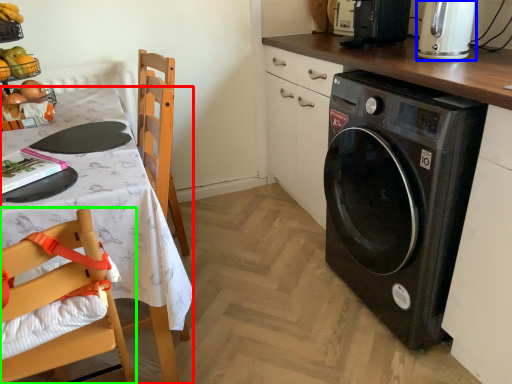
Question: Which object is the closest to the desk (highlighted by a red box)? Choose among these: kitchen appliance (highlighted by a blue box) or chair (highlighted by a green box).

Choices:
 (A) kitchen appliance
 (B) chair

Answer: (B)